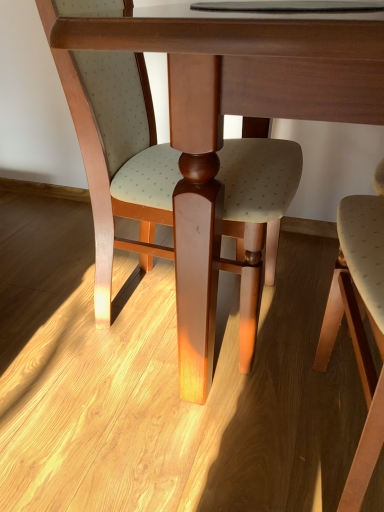
Locate an element on the screen. This screenshot has height=512, width=384. vacant area to the left of matte wood chair at center is located at coordinates (38, 321).